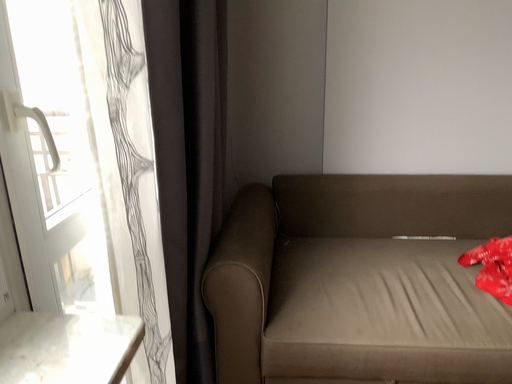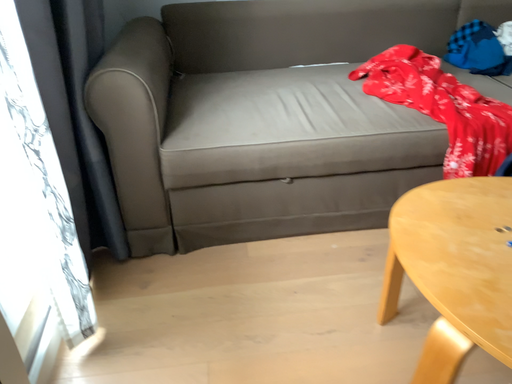
Question: How did the camera likely rotate when shooting the video?

Choices:
 (A) rotated left
 (B) rotated right

Answer: (B)